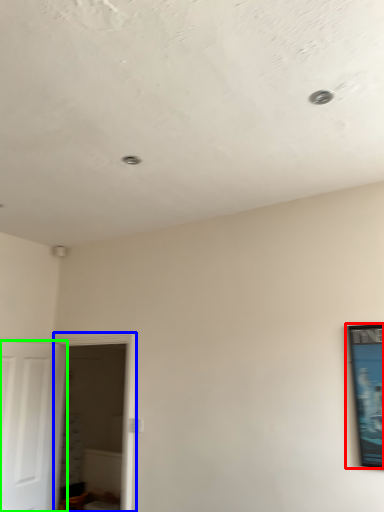
Question: Based on their relative distances, which object is farther from picture frame (highlighted by a red box)? Choose from glass door (highlighted by a blue box) and door (highlighted by a green box).

Choices:
 (A) glass door
 (B) door

Answer: (B)